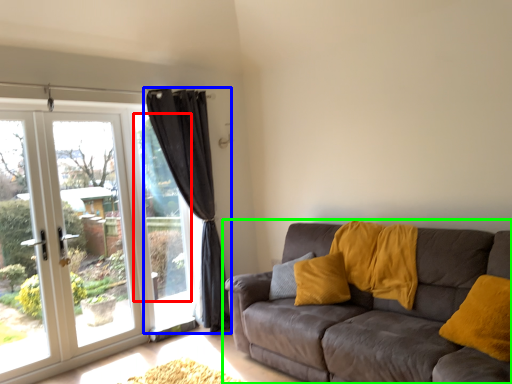
Question: Which is nearer to the window screen (highlighted by a red box)? curtain (highlighted by a blue box) or studio couch (highlighted by a green box).

Choices:
 (A) curtain
 (B) studio couch

Answer: (A)